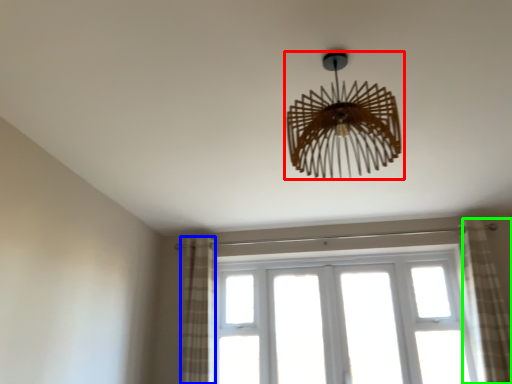
Question: Estimate the real-world distances between objects in this image. Which object is closer to lamp (highlighted by a red box), curtain (highlighted by a blue box) or curtain (highlighted by a green box)?

Choices:
 (A) curtain
 (B) curtain

Answer: (B)